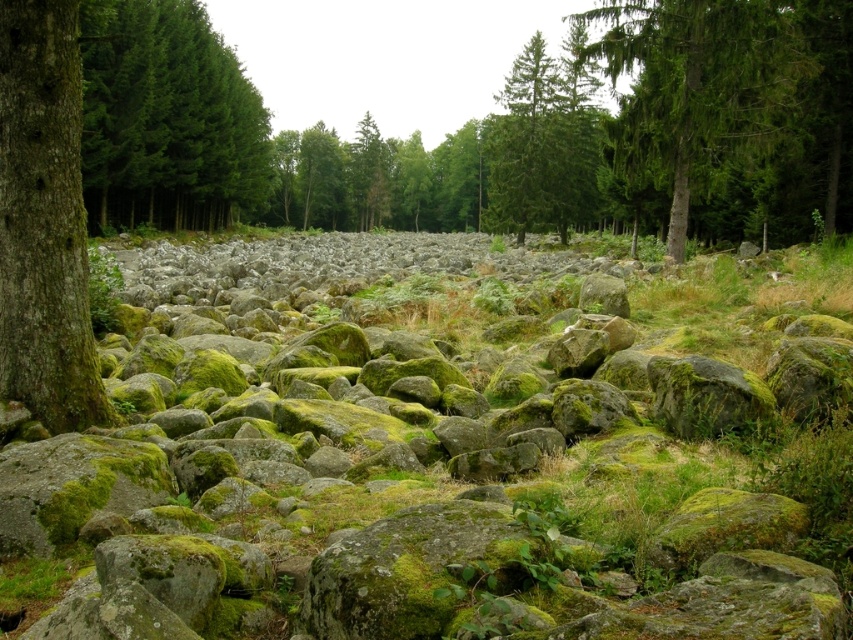
You are a hiker who wants to cross the rocky area. You notice the green mossy rocks at center and the green mossy bark tree at left. Which object is wider from your perspective?

The green mossy rocks at center are wider than the green mossy bark tree at left because the rocks at center have a greater width compared to the tree at left.

You are standing in the middle of the mossy rocks and looking towards the forest edge. You see the green matte tree at upper left and the green textured tree at upper right. Which tree appears higher in the image?

The green matte tree at upper left appears higher in the image because it is positioned above the green textured tree at upper right.